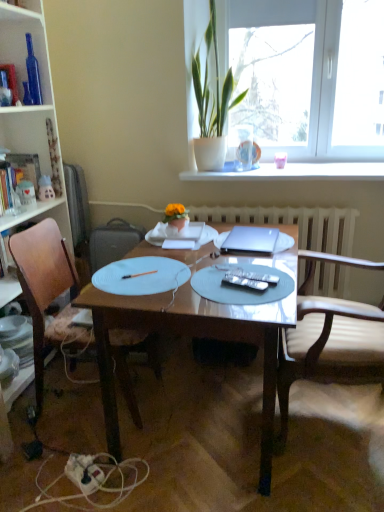
Locate an element on the screen. This screenshot has width=384, height=512. free region under light brown leather chair at right, the 2th chair in the left-to-right sequence (from a real-world perspective) is located at coordinates [x=334, y=419].